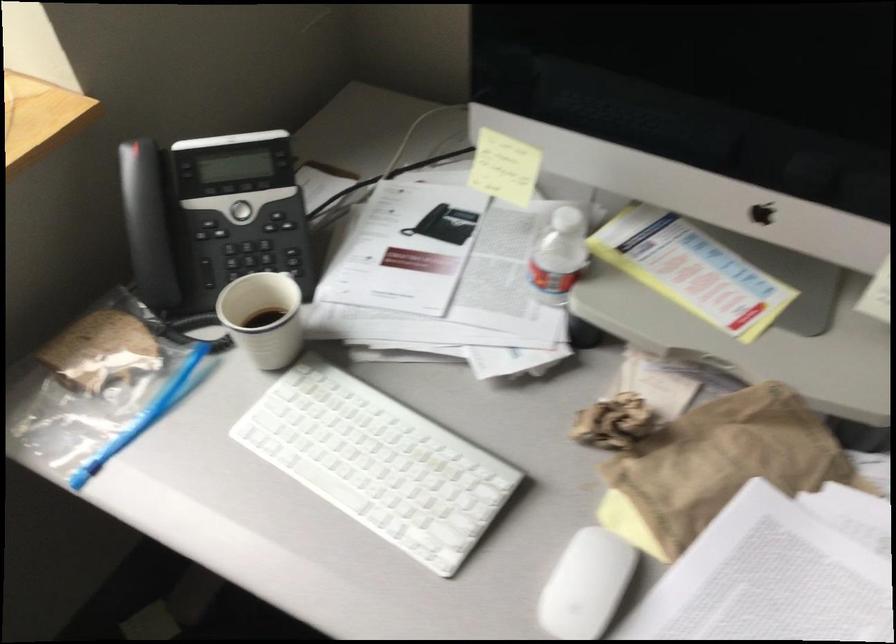
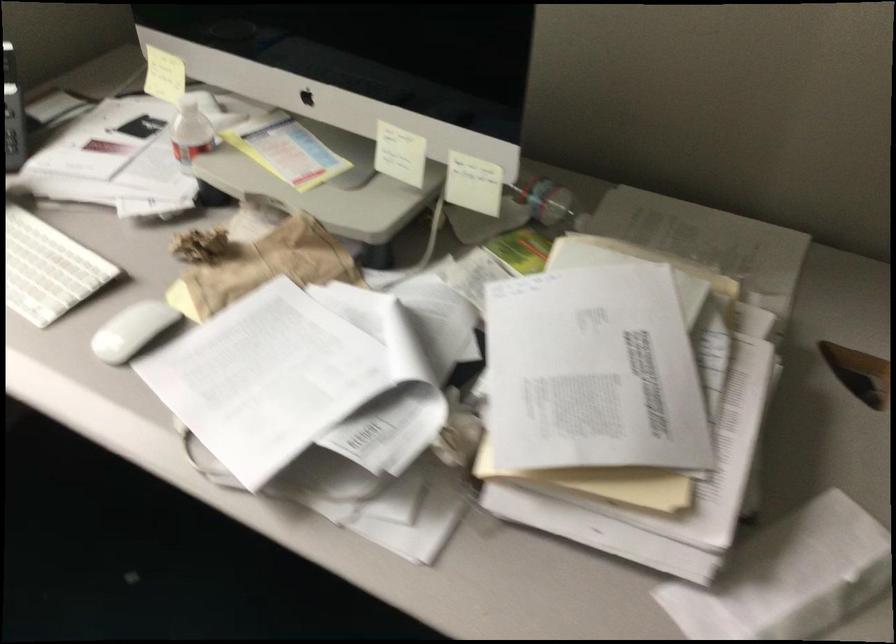
Which direction would the cameraman need to move to produce the second image?

The cameraman moved toward right, backward.